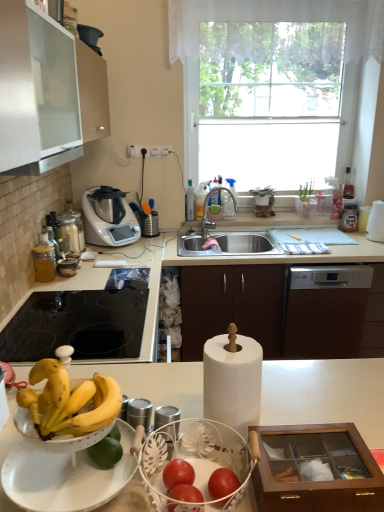
Question: Is matte silver faucet at sink center taller than black glass cooktop at lower left?

Choices:
 (A) no
 (B) yes

Answer: (B)

Question: From a real-world perspective, is matte silver faucet at sink center positioned over black glass cooktop at lower left based on gravity?

Choices:
 (A) no
 (B) yes

Answer: (B)

Question: Can we say matte silver faucet at sink center lies outside black glass cooktop at lower left?

Choices:
 (A) no
 (B) yes

Answer: (B)

Question: Is matte silver faucet at sink center further to camera compared to black glass cooktop at lower left?

Choices:
 (A) no
 (B) yes

Answer: (B)

Question: Is matte silver faucet at sink center facing towards black glass cooktop at lower left?

Choices:
 (A) no
 (B) yes

Answer: (A)

Question: Is point (135, 226) closer or farther from the camera than point (236, 267)?

Choices:
 (A) closer
 (B) farther

Answer: (B)

Question: Considering their positions, is metallic silver food processor at center-left located in front of or behind brown matte cabinet at center, acting as the 1th cabinetry starting from the back?

Choices:
 (A) front
 (B) behind

Answer: (B)

Question: Is metallic silver food processor at center-left taller or shorter than brown matte cabinet at center, arranged as the second cabinetry when ordered from the bottom?

Choices:
 (A) tall
 (B) short

Answer: (B)

Question: Do you think metallic silver food processor at center-left is within brown matte cabinet at center, acting as the 1th cabinetry starting from the back, or outside of it?

Choices:
 (A) outside
 (B) inside

Answer: (A)

Question: Is white lace curtain at upper center in front of or behind metallic silver food processor at center-left in the image?

Choices:
 (A) behind
 (B) front

Answer: (B)

Question: Is white lace curtain at upper center inside the boundaries of metallic silver food processor at center-left, or outside?

Choices:
 (A) outside
 (B) inside

Answer: (A)

Question: Considering the positions of white lace curtain at upper center and metallic silver food processor at center-left in the image, is white lace curtain at upper center taller or shorter than metallic silver food processor at center-left?

Choices:
 (A) tall
 (B) short

Answer: (B)

Question: In terms of size, does white lace curtain at upper center appear bigger or smaller than metallic silver food processor at center-left?

Choices:
 (A) small
 (B) big

Answer: (B)

Question: Is white lace curtain at upper center wider or thinner than transparent glass window at upper center?

Choices:
 (A) thin
 (B) wide

Answer: (A)

Question: Considering the positions of white lace curtain at upper center and transparent glass window at upper center in the image, is white lace curtain at upper center taller or shorter than transparent glass window at upper center?

Choices:
 (A) short
 (B) tall

Answer: (A)